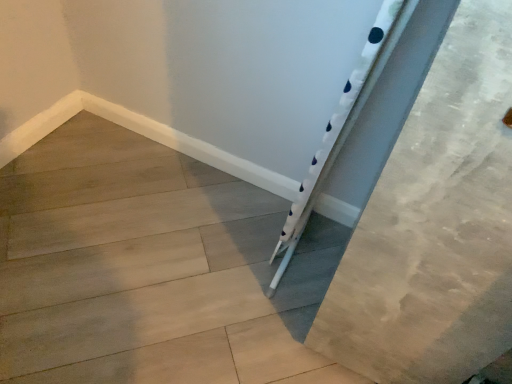
The width and height of the screenshot is (512, 384). I want to click on white glossy ladder at upper right, so click(148, 268).

Describe the element at coordinates (148, 268) in the screenshot. I see `white glossy ladder at upper right` at that location.

Where is `white glossy ladder at upper right`? white glossy ladder at upper right is located at coordinates (148, 268).